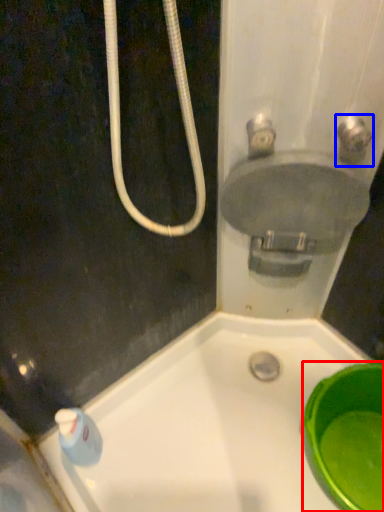
Question: Which point is closer to the camera, basin (highlighted by a red box) or plumbing fixture (highlighted by a blue box)?

Choices:
 (A) basin
 (B) plumbing fixture

Answer: (B)